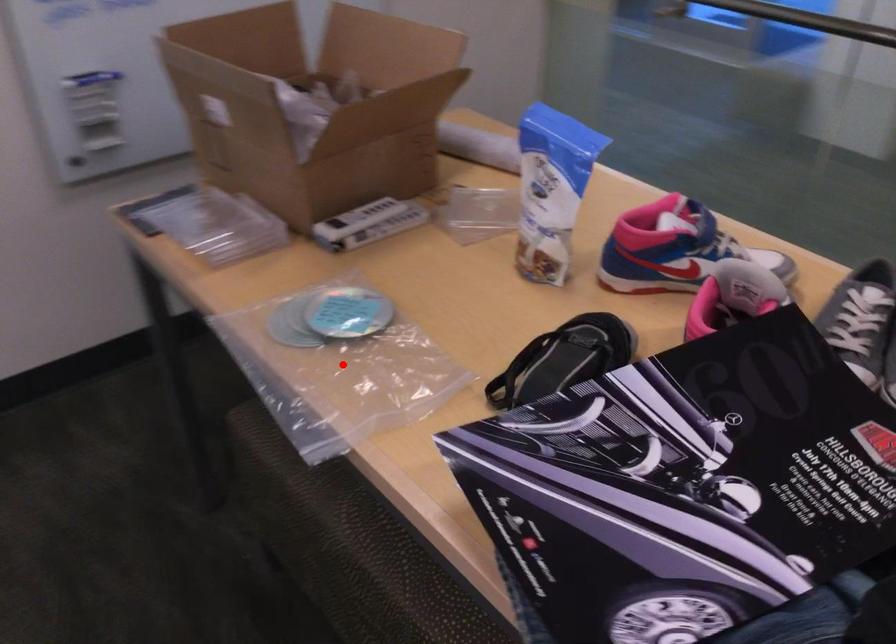
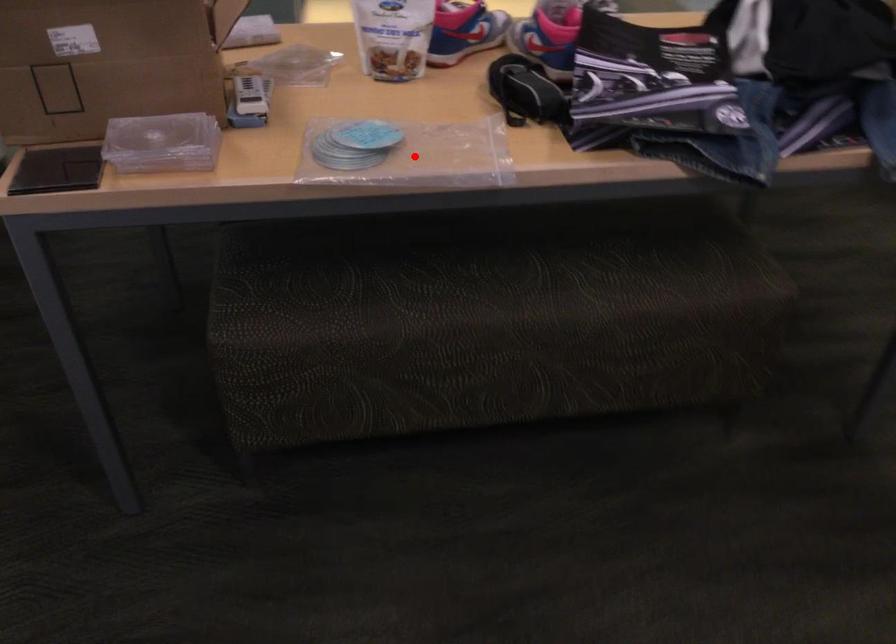
I am providing you with two images of the same scene from different viewpoints. A red point is marked on the first image and another point is marked on the second image. Does the point marked in image1 correspond to the same location as the one in image2?

Yes